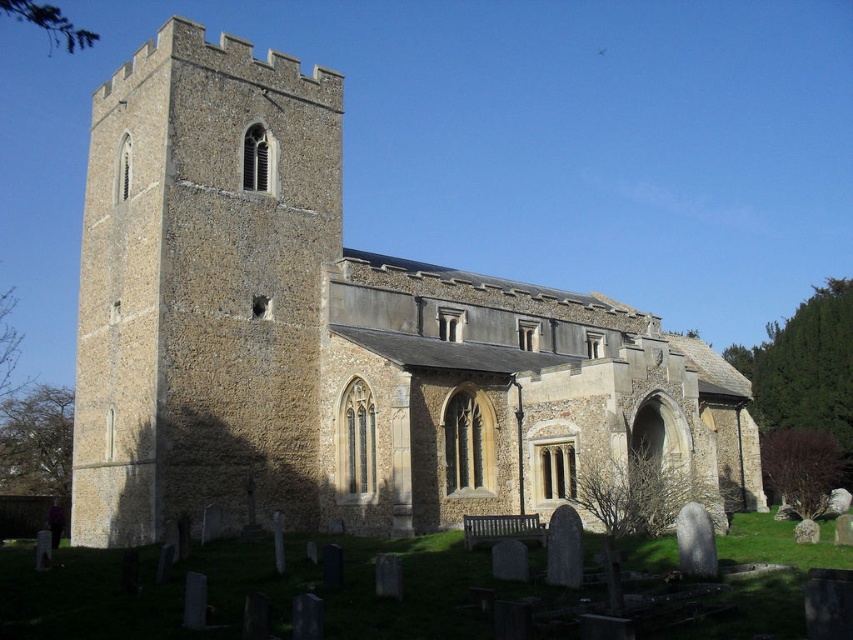
You are standing in front of the historic stone church and want to take a photo of both the brown stone church at center and the brown stone tower at left. Which one should you focus on first if you want to capture the tallest structure in the scene?

The brown stone church at center is taller than the brown stone tower at left, so you should focus on the brown stone church at center first to capture the tallest structure in the scene.

You are standing at the entrance of the historic stone church and want to locate the brown stone church at center. Where is it positioned in relation to the entrance?

The brown stone church at center is positioned at the coordinates point (335, 337), so it is located to the right and slightly forward from the entrance.

You are standing at the point marked as point (335, 337) in the image of the historic stone church. Based on the scene description, what structure are you currently located on?

The point (335, 337) is located on the brown stone church at center, which is the main body of the church connected to the tower.